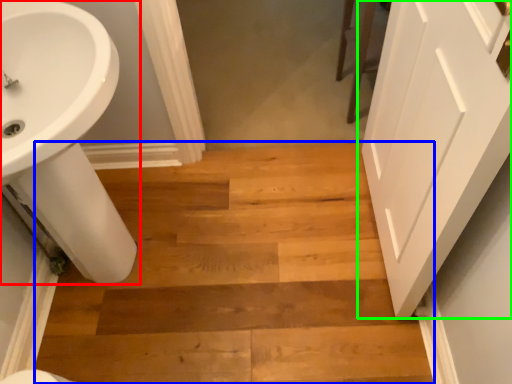
Question: Which object is positioned farthest from sink (highlighted by a red box)? Select from stairwell (highlighted by a blue box) and door (highlighted by a green box).

Choices:
 (A) stairwell
 (B) door

Answer: (B)